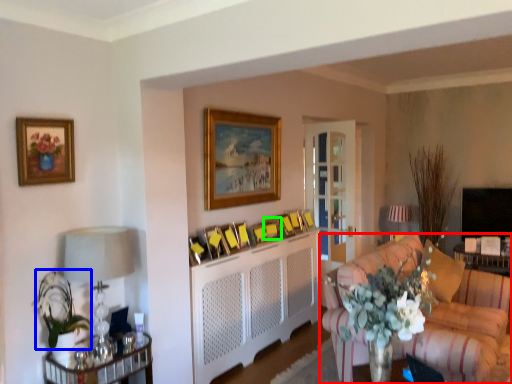
Question: Estimate the real-world distances between objects in this image. Which object is closer to studio couch (highlighted by a red box), floral arrangement (highlighted by a blue box) or picture frame (highlighted by a green box)?

Choices:
 (A) floral arrangement
 (B) picture frame

Answer: (B)